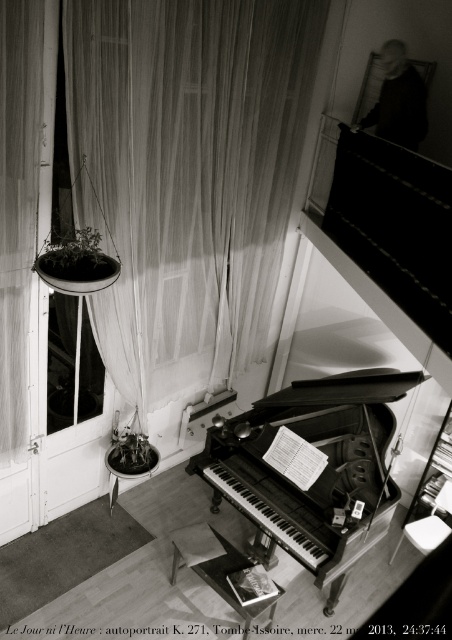
Question: Estimate the real-world distances between objects in this image. Which object is closer to the transparent glass window at center?

Choices:
 (A) black polished piano at center
 (B) translucent fabric curtain at upper center

Answer: (B)

Question: Does translucent fabric curtain at upper center appear under black polished piano at center?

Choices:
 (A) no
 (B) yes

Answer: (A)

Question: Does translucent fabric curtain at upper center appear on the right side of transparent glass window at center?

Choices:
 (A) yes
 (B) no

Answer: (A)

Question: Does translucent fabric curtain at upper center appear on the right side of transparent glass window at center?

Choices:
 (A) yes
 (B) no

Answer: (A)

Question: Estimate the real-world distances between objects in this image. Which object is farther from the translucent fabric curtain at upper center?

Choices:
 (A) transparent glass window at center
 (B) black polished piano at center

Answer: (B)

Question: Which object is the farthest from the black polished piano at center?

Choices:
 (A) transparent glass window at center
 (B) translucent fabric curtain at upper center

Answer: (A)